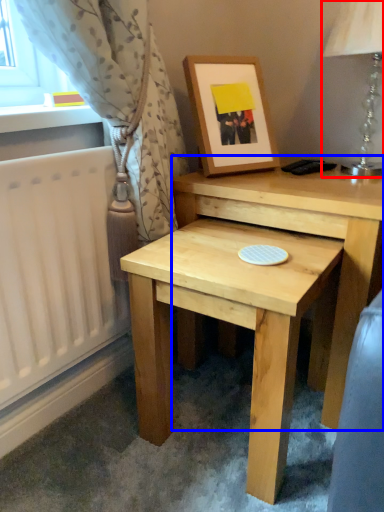
Question: Among these objects, which one is farthest to the camera, table lamp (highlighted by a red box) or table (highlighted by a blue box)?

Choices:
 (A) table lamp
 (B) table

Answer: (A)